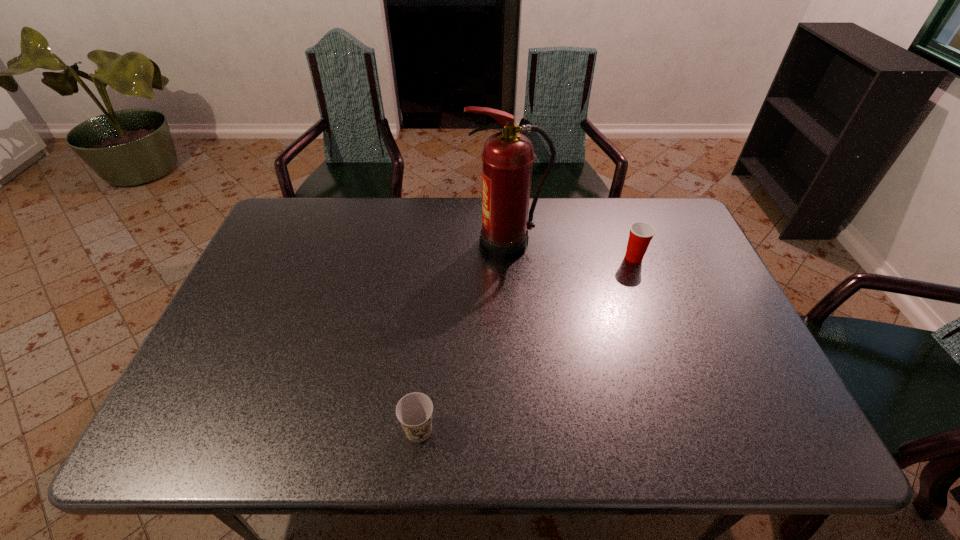
What are the coordinates of `vacant area that lies between the second object from right to left and the farther Dixie cup` in the screenshot? It's located at (570, 251).

Locate an element on the screen. This screenshot has height=540, width=960. vacant region between the fire extinguisher and the taller Dixie cup is located at coordinates (570, 251).

Image resolution: width=960 pixels, height=540 pixels. Identify the location of free spot between the tallest object and the farther Dixie cup. (570, 251).

Find the location of `free space between the rightmost object and the tallest object`. free space between the rightmost object and the tallest object is located at coordinates (570, 251).

This screenshot has height=540, width=960. I want to click on free space between the fire extinguisher and the farther Dixie cup, so click(x=570, y=251).

The image size is (960, 540). Find the location of `free area in between the rightmost object and the shortest object`. free area in between the rightmost object and the shortest object is located at coordinates (526, 344).

Locate an element on the screen. This screenshot has height=540, width=960. free space between the fire extinguisher and the shortest object is located at coordinates (463, 337).

Identify the location of vacant space that is in between the second object from right to left and the leftmost object. (463, 337).

Identify the location of vacant area that lies between the tallest object and the second tallest object. (570, 251).

Find the location of a particular element. vacant point located between the tallest object and the right Dixie cup is located at coordinates (570, 251).